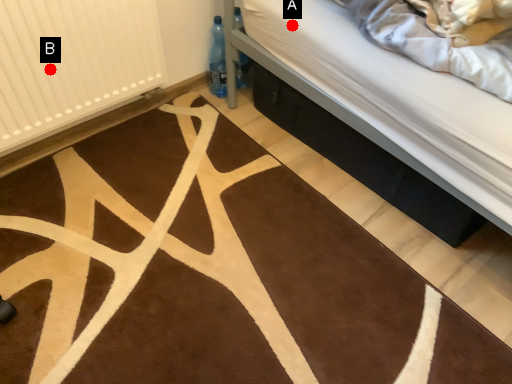
Question: Two points are circled on the image, labeled by A and B beside each circle. Which point is farther to the camera?

Choices:
 (A) A is further
 (B) B is further

Answer: (B)